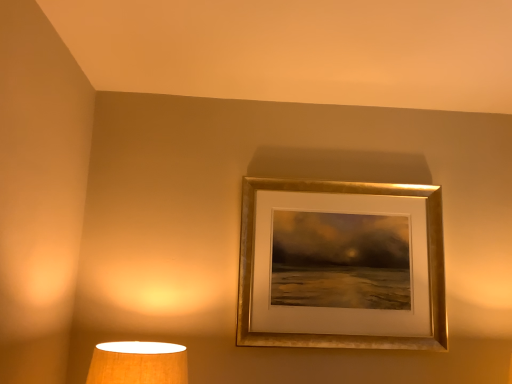
Question: Should I look upward or downward to see gold metallic picture frame at upper center?

Choices:
 (A) up
 (B) down

Answer: (B)